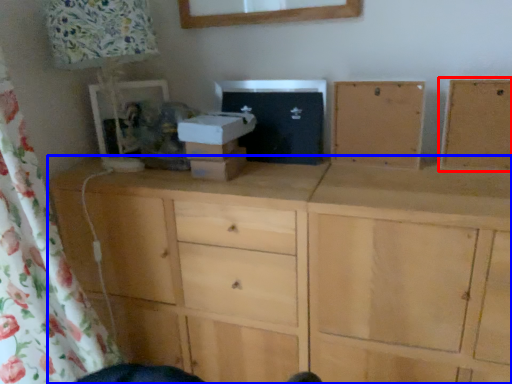
Question: Which of the following is the farthest to the observer, cabinetry (highlighted by a red box) or chest of drawers (highlighted by a blue box)?

Choices:
 (A) cabinetry
 (B) chest of drawers

Answer: (A)